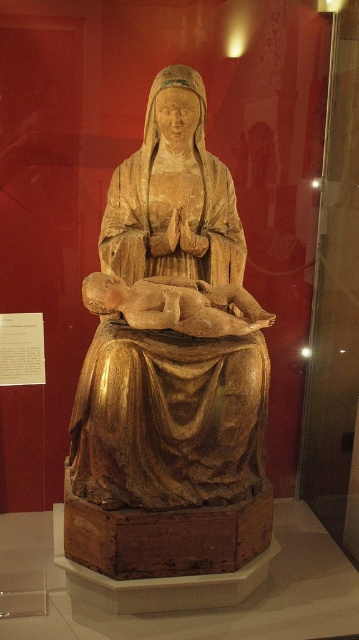
This screenshot has width=359, height=640. Describe the element at coordinates (170, 364) in the screenshot. I see `golden polished wood statue at center` at that location.

Which is more to the left, golden polished wood statue at center or golden wood statue at center?

Positioned to the left is golden polished wood statue at center.

Find the location of `golden polished wood statue at center`. golden polished wood statue at center is located at coordinates (170, 364).

Is golden polished wood statue at center thinner than matte wood baby at center?

No, golden polished wood statue at center is not thinner than matte wood baby at center.

Does golden polished wood statue at center have a larger size compared to matte wood baby at center?

Correct, golden polished wood statue at center is larger in size than matte wood baby at center.

Identify the location of golden polished wood statue at center. (170, 364).

In the scene shown: Is golden wood statue at center shorter than matte wood baby at center?

Incorrect, golden wood statue at center's height does not fall short of matte wood baby at center's.

The height and width of the screenshot is (640, 359). What do you see at coordinates (173, 195) in the screenshot? I see `golden wood statue at center` at bounding box center [173, 195].

The height and width of the screenshot is (640, 359). Describe the element at coordinates (173, 195) in the screenshot. I see `golden wood statue at center` at that location.

The image size is (359, 640). What are the coordinates of `golden wood statue at center` in the screenshot? It's located at (173, 195).